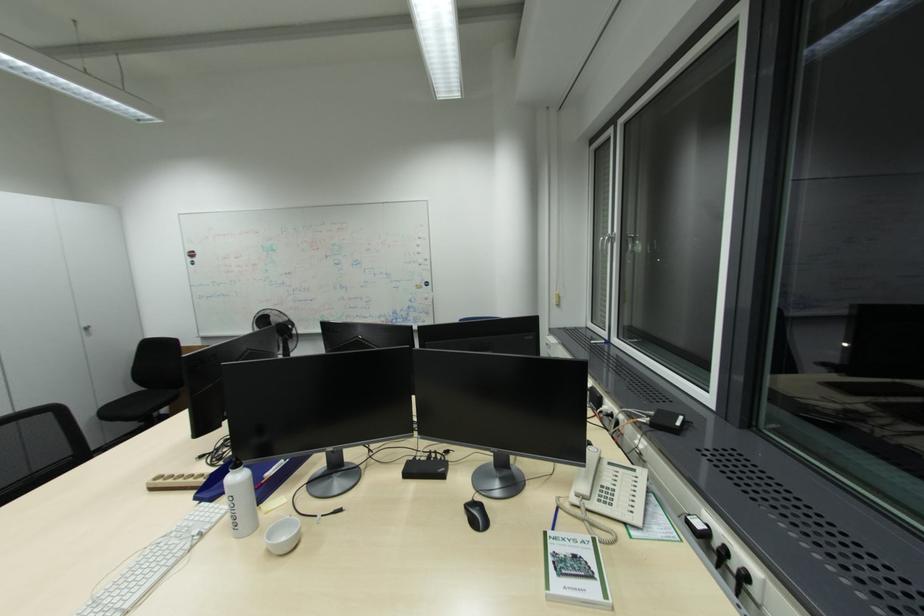
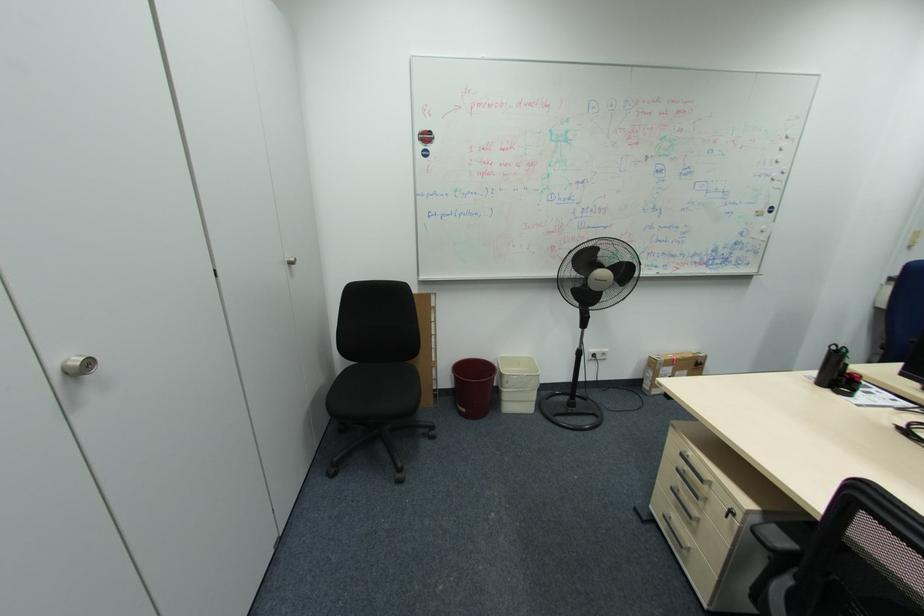
Which direction would the cameraman need to move to produce the second image?

The cameraman walked toward left, forward.